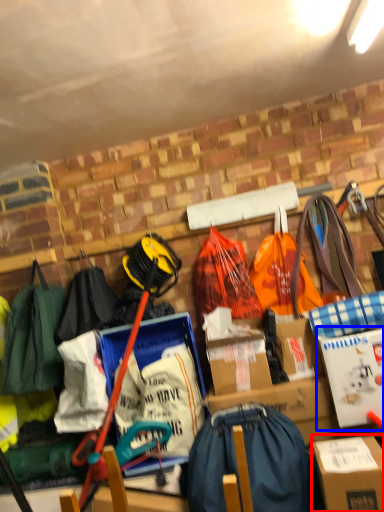
Question: Which object is further to the camera taking this photo, box (highlighted by a red box) or cardboard box (highlighted by a blue box)?

Choices:
 (A) box
 (B) cardboard box

Answer: (B)